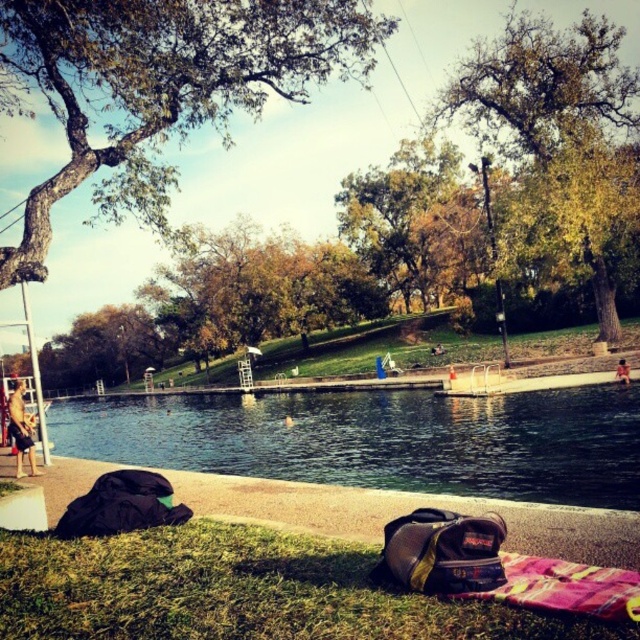
You are standing at the center of the image and want to walk towards the green grass at lower left. What direction should you face to head directly towards it?

You should face the lower left direction to head directly towards the green grass at lower left since it is located at point (240, 592).

You are a lifeguard standing at the center of the walkway. You see the tan skin person at lower left and the skinny person at lower right walking towards the water. If you need to reach both of them before they enter the water, which direction should you run first?

Since the distance between the tan skin person at lower left and the skinny person at lower right is 20.70 meters, you should run towards the closer one first. However, the description does not specify which is closer. Therefore, you need to assess their positions based on their direction of movement and the layout of the walkway to determine the shortest path.

You are standing at the center of the image and want to find the tan skin person at lower left. In which direction should you look to see them?

You should look towards the lower left direction to see the tan skin person at lower left since their 2D location is at point (20, 429), which places them in the lower left quadrant of the image.